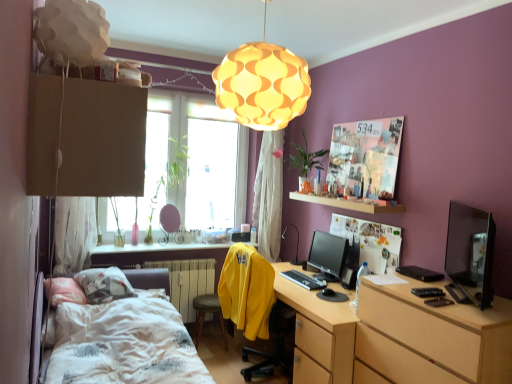
Question: Is matte black monitor at center surrounded by wooden desk at center?

Choices:
 (A) yes
 (B) no

Answer: (B)

Question: Considering the relative sizes of wooden desk at center and matte black monitor at center in the image provided, is wooden desk at center shorter than matte black monitor at center?

Choices:
 (A) no
 (B) yes

Answer: (A)

Question: Does wooden desk at center lie in front of matte black monitor at center?

Choices:
 (A) no
 (B) yes

Answer: (B)

Question: From the image's perspective, does wooden desk at center appear lower than matte black monitor at center?

Choices:
 (A) yes
 (B) no

Answer: (A)

Question: Is wooden desk at center to the left of matte black monitor at center from the viewer's perspective?

Choices:
 (A) no
 (B) yes

Answer: (B)

Question: Does wooden desk at center turn towards matte black monitor at center?

Choices:
 (A) no
 (B) yes

Answer: (A)

Question: Considering the relative positions of matte black table lamp at center and matte paper collage at upper right, which is the 1th poster page in top-to-bottom order, in the image provided, is matte black table lamp at center to the left of matte paper collage at upper right, which is the 1th poster page in top-to-bottom order, from the viewer's perspective?

Choices:
 (A) no
 (B) yes

Answer: (B)

Question: Can you confirm if matte black table lamp at center is taller than matte paper collage at upper right, the 2th poster page from the bottom?

Choices:
 (A) yes
 (B) no

Answer: (B)

Question: Considering the relative positions of matte black table lamp at center and matte paper collage at upper right, which is the 1th poster page in top-to-bottom order, in the image provided, is matte black table lamp at center to the right of matte paper collage at upper right, which is the 1th poster page in top-to-bottom order, from the viewer's perspective?

Choices:
 (A) no
 (B) yes

Answer: (A)

Question: Is the depth of matte black table lamp at center greater than that of matte paper collage at upper right, which is the 1th poster page in top-to-bottom order?

Choices:
 (A) yes
 (B) no

Answer: (A)

Question: Could you tell me if matte black table lamp at center is facing matte paper collage at upper right, the 2th poster page from the bottom?

Choices:
 (A) yes
 (B) no

Answer: (B)

Question: Can you confirm if matte black table lamp at center is bigger than matte paper collage at upper right, which is the 1th poster page in top-to-bottom order?

Choices:
 (A) yes
 (B) no

Answer: (A)

Question: Considering the relative positions of matte paper collage at upper right, which is the 1th poster page in top-to-bottom order, and matte black monitor at center in the image provided, is matte paper collage at upper right, which is the 1th poster page in top-to-bottom order, to the right of matte black monitor at center from the viewer's perspective?

Choices:
 (A) yes
 (B) no

Answer: (A)